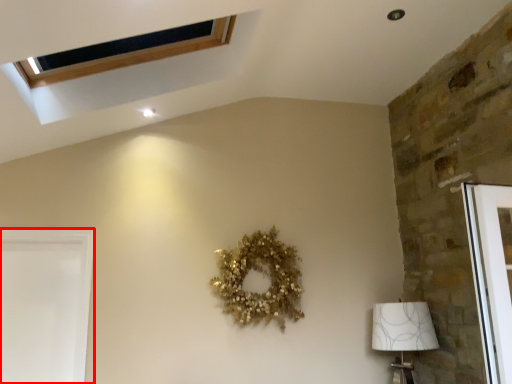
Question: From the image's perspective, what is the correct spatial positioning of screen door (annotated by the red box) in reference to lamp?

Choices:
 (A) above
 (B) below

Answer: (A)